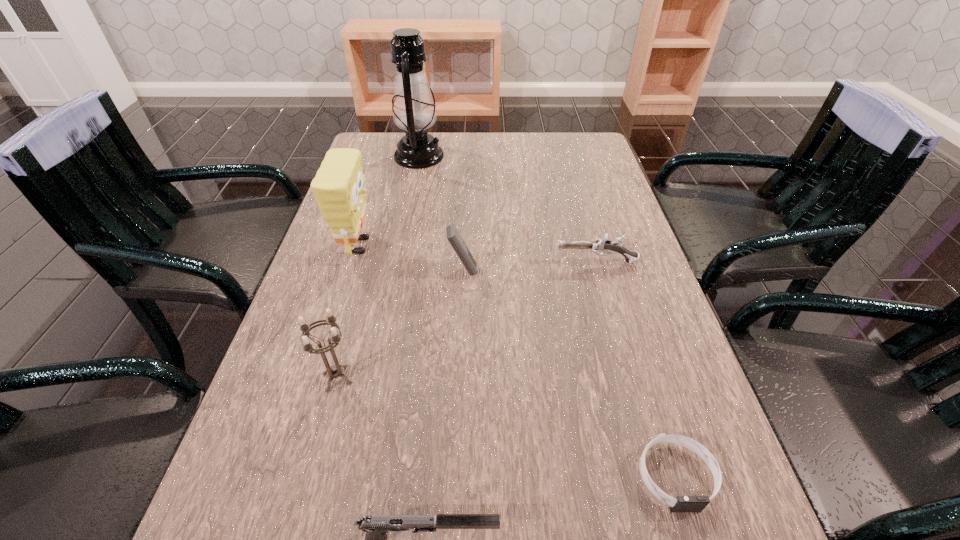
I want to click on oil lamp, so click(413, 108).

Locate an element on the screen. The height and width of the screenshot is (540, 960). the farthest object is located at coordinates (413, 108).

Find the location of a particular element. The width and height of the screenshot is (960, 540). the sixth shortest object is located at coordinates (338, 186).

At what (x,y) coordinates should I click in order to perform the action: click on the fifth shortest object. Please return your answer as a coordinate pair (x, y). The width and height of the screenshot is (960, 540). Looking at the image, I should click on (334, 371).

Where is `the fifth farthest object`? the fifth farthest object is located at coordinates (334, 371).

Locate an element on the screen. calculator is located at coordinates (453, 236).

Locate an element on the screen. This screenshot has height=540, width=960. the right gun is located at coordinates (603, 245).

You are a GUI agent. You are given a task and a screenshot of the screen. Output one action in this format:
    pyautogui.click(x=<x>, y=<y>)
    Task: Click on the sixth farthest object
    
    Given the screenshot: What is the action you would take?
    pos(682,503)

Find the location of a particular element. This screenshot has width=960, height=540. wristband is located at coordinates (682, 503).

Where is `free location located on the front of the tallest object`? free location located on the front of the tallest object is located at coordinates (410, 200).